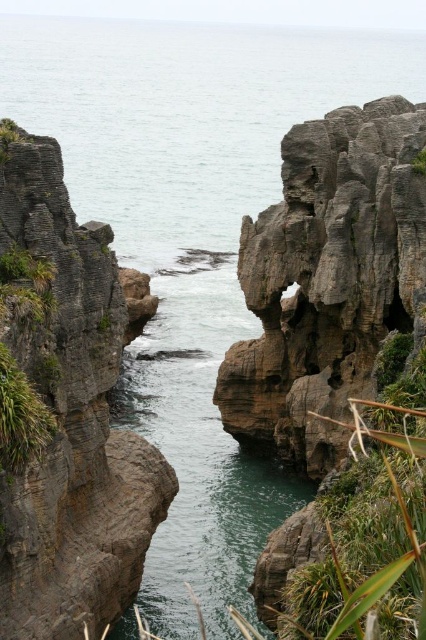
Based on the photo, who is positioned more to the right, rough gray rock at center or green leafy plant at lower right?

Positioned to the right is rough gray rock at center.

Between point (294, 420) and point (400, 476), which one is positioned behind?

The point (294, 420) is behind.

Where is `rough gray rock at center`? Image resolution: width=426 pixels, height=640 pixels. rough gray rock at center is located at coordinates (327, 278).

Describe the element at coordinates (63, 412) in the screenshot. Image resolution: width=426 pixels, height=640 pixels. I see `gray rock at center` at that location.

Does point (3, 404) come closer to viewer compared to point (331, 579)?

No, (3, 404) is further to viewer.

Does point (97, 460) come farther from viewer compared to point (376, 502)?

Yes, it is behind point (376, 502).

Identify the location of gray rock at center. The image size is (426, 640). (63, 412).

Between gray rock at center and rough gray rock at center, which one is positioned lower?

Positioned lower is gray rock at center.

Between gray rock at center and rough gray rock at center, which one has less height?

Standing shorter between the two is gray rock at center.

Does point (43, 150) come farther from viewer compared to point (350, 380)?

That is False.

Where is `gray rock at center`? The image size is (426, 640). gray rock at center is located at coordinates (63, 412).